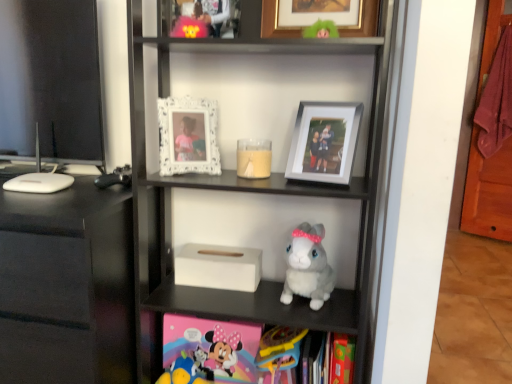
Question: Is white glossy computer monitor at left wider or thinner than white matte tissue box at center?

Choices:
 (A) wide
 (B) thin

Answer: (B)

Question: From a real-world perspective, relative to white matte tissue box at center, is white glossy computer monitor at left vertically above or below?

Choices:
 (A) below
 (B) above

Answer: (B)

Question: Which object is the closest to the silver metallic photo frame at upper center, which is the third picture frame in left-to-right order?

Choices:
 (A) soft plush toy at lower center, which appears as the 1th toy when viewed from the left
 (B) white ornate frame at upper center, which is the second picture frame in bottom-to-top order
 (C) black glossy tv stand at left
 (D) hardcover book at lower center
 (E) white matte tissue box at center

Answer: (B)

Question: Estimate the real-world distances between objects in this image. Which object is farther from the white matte tissue box at center?

Choices:
 (A) white ornate frame at upper center, positioned as the third picture frame in right-to-left order
 (B) hardcover book at lower center
 (C) fluffy gray plush at center, arranged as the first toy when viewed from the right
 (D) plastic yellow toy at lower center, marked as the 2th toy in a left-to-right arrangement
 (E) gold-framed picture at upper center, placed as the third picture frame when sorted from bottom to top

Answer: (E)